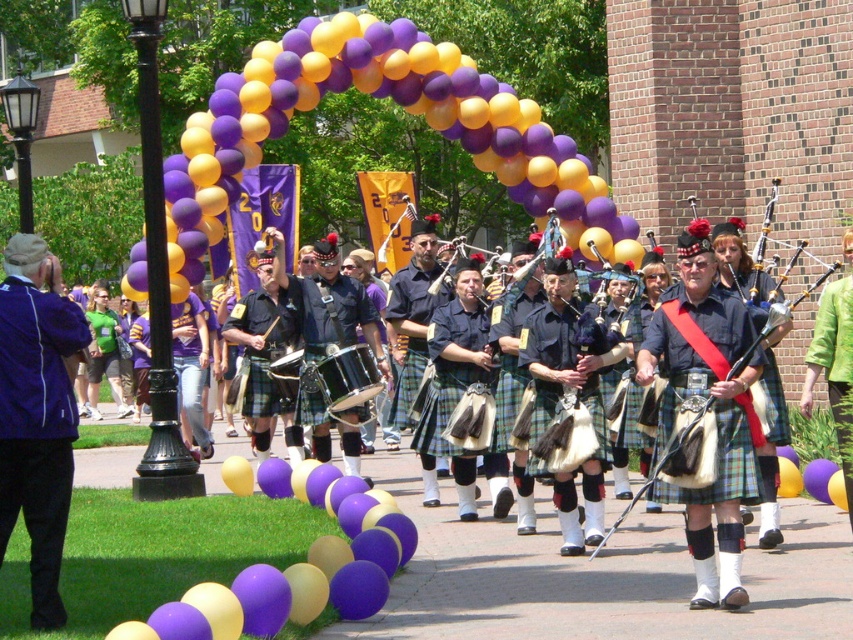
Question: Which point is farther from the camera taking this photo?

Choices:
 (A) (701, 346)
 (B) (306, 380)

Answer: (B)

Question: Does matte black kilt at center appear under plaid fabric kilt at center?

Choices:
 (A) yes
 (B) no

Answer: (A)

Question: Does shiny black drum at center appear on the left side of plaid fabric kilt at center?

Choices:
 (A) no
 (B) yes

Answer: (B)

Question: Can you confirm if shiny black drum at center is wider than plaid fabric kilt at center?

Choices:
 (A) yes
 (B) no

Answer: (A)

Question: Which point is farther to the camera?

Choices:
 (A) coord(386,54)
 (B) coord(361,420)

Answer: (A)

Question: Estimate the real-world distances between objects in this image. Which object is closer to the purple fabric jacket at left?

Choices:
 (A) purple glossy balloons at center
 (B) shiny black drum at center
 (C) matte black kilt at center

Answer: (C)